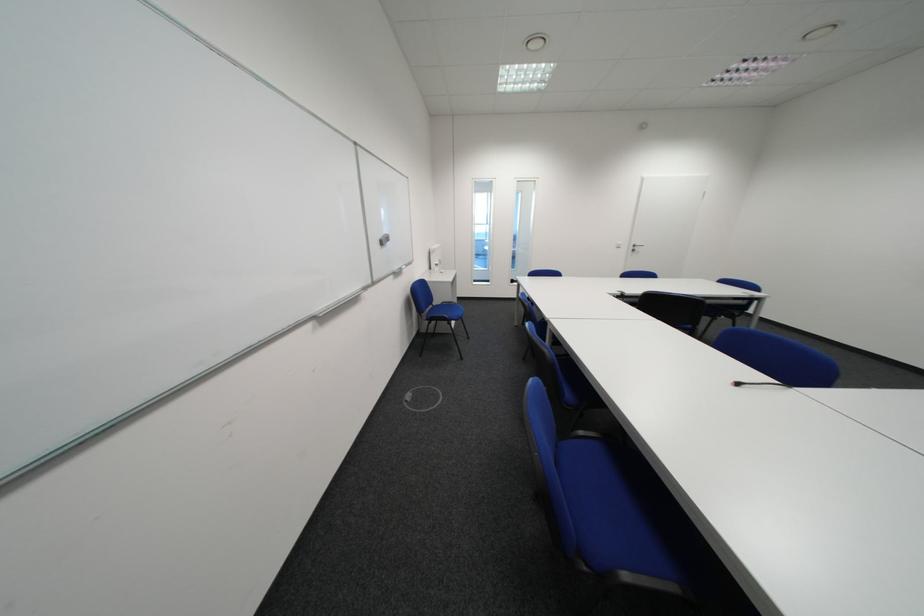
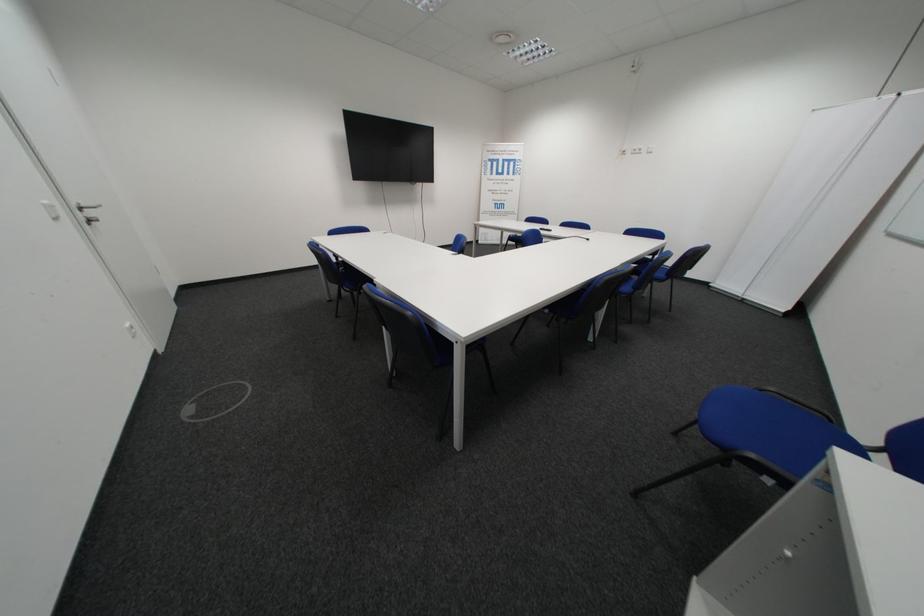
Where in the second image is the point corresponding to [647,246] from the first image?

(93, 209)